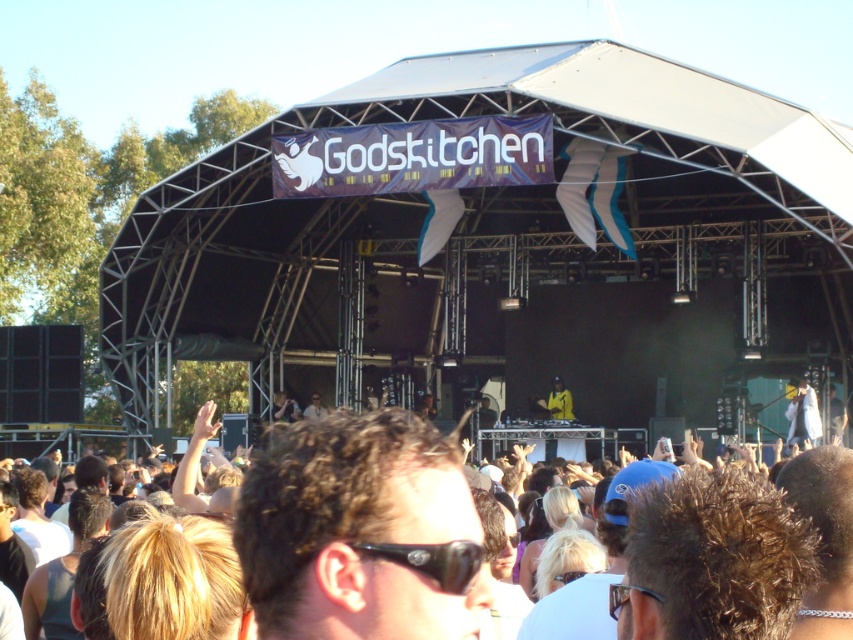
Question: Which of the following is the closest to the observer?

Choices:
 (A) yellow fabric at center
 (B) light brown hair at center
 (C) clear plastic glasses at center

Answer: (C)

Question: Which object appears closest to the camera in this image?

Choices:
 (A) black plastic sunglasses at center
 (B) clear plastic glasses at center

Answer: (A)

Question: Is yellow fabric at center wider than clear plastic glasses at center?

Choices:
 (A) no
 (B) yes

Answer: (B)

Question: Which is nearer to the light brown hair at center?

Choices:
 (A) clear plastic glasses at center
 (B) yellow fabric at center
 (C) black plastic sunglasses at center

Answer: (B)

Question: Observing the image, what is the correct spatial positioning of black plastic sunglasses at center in reference to yellow fabric at center?

Choices:
 (A) below
 (B) above

Answer: (A)

Question: In this image, where is black plastic sunglasses at center located relative to yellow fabric at center?

Choices:
 (A) below
 (B) above

Answer: (A)